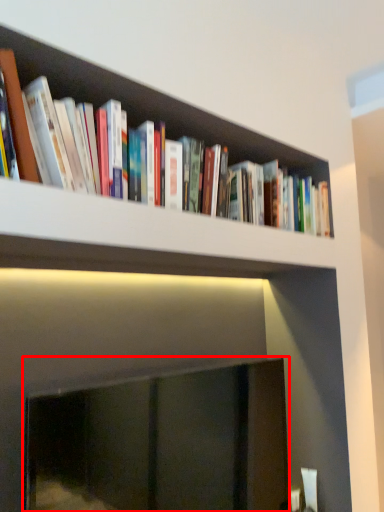
Question: Observing the image, what is the correct spatial positioning of fireplace (annotated by the red box) in reference to book?

Choices:
 (A) right
 (B) left

Answer: (B)